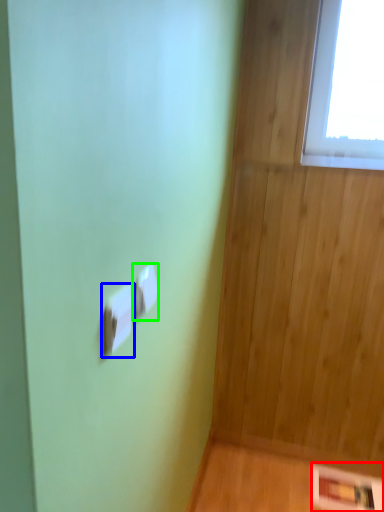
Question: Which object is the closest to the panel (highlighted by a red box)? Choose among these: light switch (highlighted by a blue box) or light switch (highlighted by a green box).

Choices:
 (A) light switch
 (B) light switch

Answer: (B)